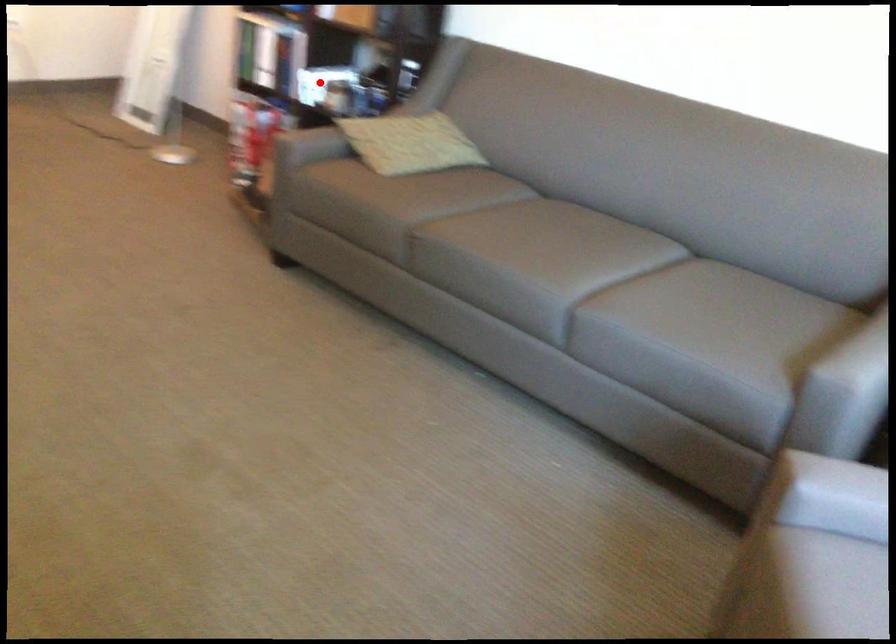
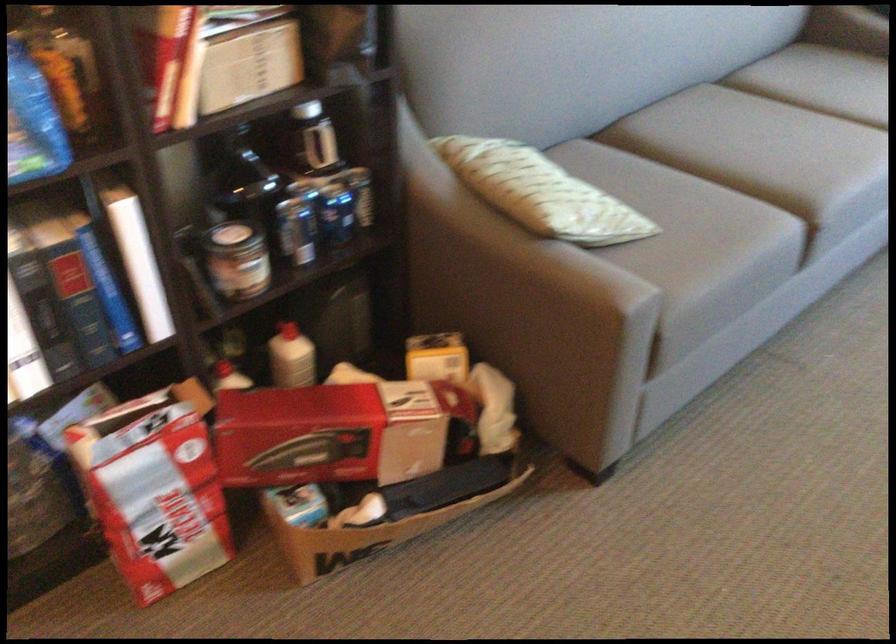
The point at the highlighted location is marked in the first image. Where is the corresponding point in the second image?

(297, 230)